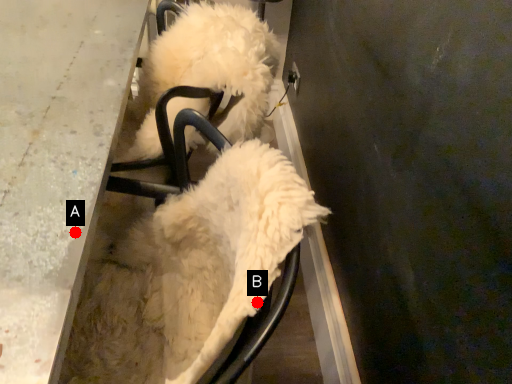
Question: Two points are circled on the image, labeled by A and B beside each circle. Which point is farther to the camera?

Choices:
 (A) A is further
 (B) B is further

Answer: (A)